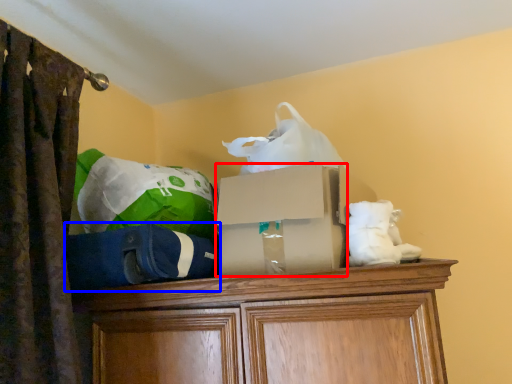
Question: Which point is closer to the camera, storage box (highlighted by a red box) or bean bag chair (highlighted by a blue box)?

Choices:
 (A) storage box
 (B) bean bag chair

Answer: (B)